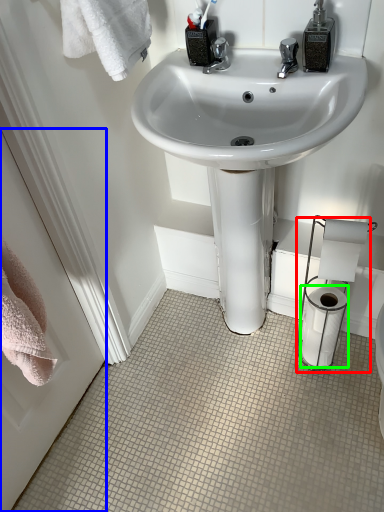
Question: Estimate the real-world distances between objects in this image. Which object is farther from toilet paper (highlighted by a red box), screen door (highlighted by a blue box) or toilet paper (highlighted by a green box)?

Choices:
 (A) screen door
 (B) toilet paper

Answer: (A)